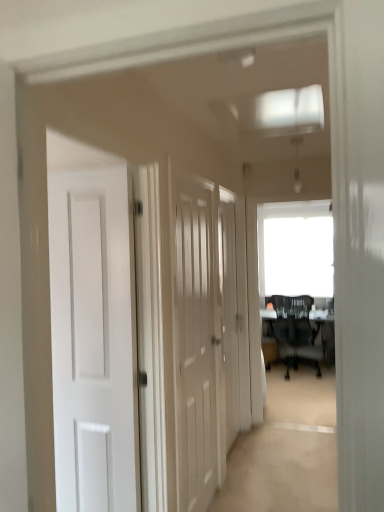
This screenshot has height=512, width=384. I want to click on free space in front of black mesh chair at center, so click(299, 382).